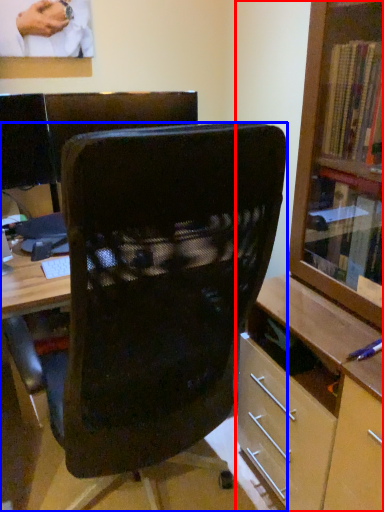
Question: Which of the following is the farthest to the observer, shelf (highlighted by a red box) or chair (highlighted by a blue box)?

Choices:
 (A) shelf
 (B) chair

Answer: (B)